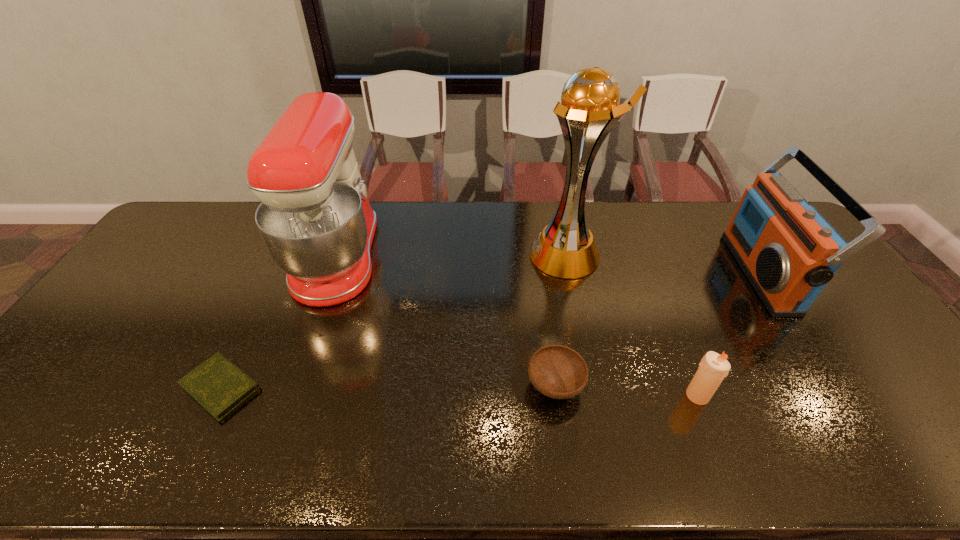
Locate an element on the screen. This screenshot has height=540, width=960. radio receiver that is at the far edge is located at coordinates (788, 251).

Identify the location of object located in the right edge section of the desktop. (788, 251).

Locate an element on the screen. object present at the far right corner is located at coordinates (788, 251).

Where is `vacant region at the far edge of the desktop`? This screenshot has width=960, height=540. vacant region at the far edge of the desktop is located at coordinates (510, 235).

Locate an element on the screen. This screenshot has width=960, height=540. vacant area at the near edge of the desktop is located at coordinates (381, 437).

Locate an element on the screen. Image resolution: width=960 pixels, height=540 pixels. vacant space at the right edge is located at coordinates (849, 299).

This screenshot has height=540, width=960. Find the location of `vacant area that lies between the tallest object and the diary`. vacant area that lies between the tallest object and the diary is located at coordinates (394, 321).

Image resolution: width=960 pixels, height=540 pixels. Identify the location of vacant point located between the third shortest object and the trophy. (632, 325).

Locate an element on the screen. This screenshot has height=540, width=960. vacant area that lies between the mixer and the tallest object is located at coordinates (452, 256).

Where is `vacant area that lies between the tallest object and the diary`? vacant area that lies between the tallest object and the diary is located at coordinates (394, 321).